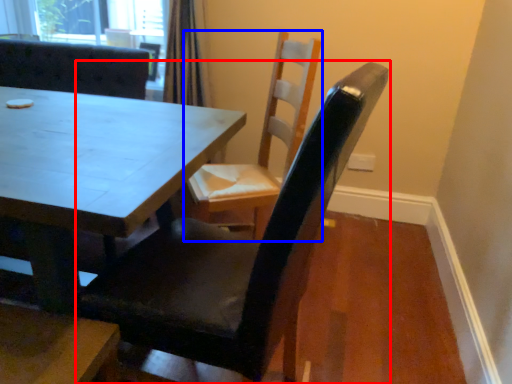
Question: Which point is closer to the camera, chair (highlighted by a red box) or chair (highlighted by a blue box)?

Choices:
 (A) chair
 (B) chair

Answer: (A)